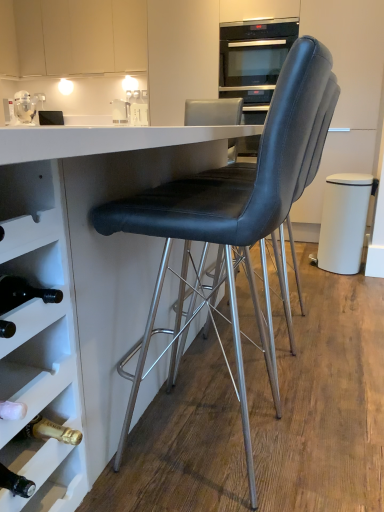
What is the approximate height of black leather chair at center, which is the second chair from back to front?

3.65 feet.

In order to face black leather chair at center, the 2th chair in the front-to-back sequence, should I rotate leftwards or rightwards?

It's best to rotate right around 10.428 degrees.

You are a GUI agent. You are given a task and a screenshot of the screen. Output one action in this format:
    pyautogui.click(x=<x>, y=<y>)
    Task: Click on the matte white cabinet at upper left
    The image size is (384, 512).
    Given the screenshot: What is the action you would take?
    pyautogui.click(x=72, y=36)

The height and width of the screenshot is (512, 384). Describe the element at coordinates (72, 36) in the screenshot. I see `matte white cabinet at upper left` at that location.

At what (x,y) coordinates should I click in order to perform the action: click on clear glass jar at upper left. Please return your answer as a coordinate pair (x, y). The image size is (384, 512). Looking at the image, I should click on (24, 106).

Describe the element at coordinates (120, 111) in the screenshot. This screenshot has height=512, width=384. I see `metallic silver kettle at upper center` at that location.

Identify the location of white glossy table at center. (78, 292).

Based on the photo, is metallic silver kettle at upper center turned away from white matte trash can at right?

That's not correct — metallic silver kettle at upper center is not looking away from white matte trash can at right.

Can you tell me how much metallic silver kettle at upper center and white matte trash can at right differ in facing direction?

The angular difference between metallic silver kettle at upper center and white matte trash can at right is 89 degrees.

Considering the points (123, 114) and (347, 244), which point is behind, point (123, 114) or point (347, 244)?

The point (123, 114) is more distant.

From the image's perspective, who appears lower, metallic silver kettle at upper center or white matte trash can at right?

white matte trash can at right appears lower in the image.

Considering the sizes of objects matte white cabinet at upper left and white matte trash can at right in the image provided, who is thinner, matte white cabinet at upper left or white matte trash can at right?

Thinner between the two is matte white cabinet at upper left.

The image size is (384, 512). Identify the location of bar stool to the right of matte white cabinet at upper left. (343, 222).

From the image's perspective, which one is positioned lower, matte white cabinet at upper left or white matte trash can at right?

From the image's view, white matte trash can at right is below.

Considering the positions of point (59, 17) and point (353, 203), is point (59, 17) closer or farther from the camera than point (353, 203)?

Clearly, point (59, 17) is more distant from the camera than point (353, 203).

Is black leather chair at center, arranged as the 1th chair when viewed from the front, oriented away from white matte trash can at right?

No.

In the scene shown: Which of these two, black leather chair at center, which is the second chair from back to front, or white matte trash can at right, is thinner?

With smaller width is white matte trash can at right.

Looking at this image, which object is further away from the camera taking this photo, black leather chair at center, which is the second chair from back to front, or white matte trash can at right?

Positioned behind is white matte trash can at right.

From a real-world perspective, between black leather chair at center, which is the second chair from back to front, and white matte trash can at right, who is vertically lower?

In real-world perspective, white matte trash can at right is lower.

From the image's perspective, is black glass oven at upper center below matte white cabinet at upper left?

Indeed, from the image's perspective, black glass oven at upper center is shown beneath matte white cabinet at upper left.

Which of these two, black glass oven at upper center or matte white cabinet at upper left, is thinner?

Thinner between the two is matte white cabinet at upper left.

Is black glass oven at upper center not within matte white cabinet at upper left?

Indeed, black glass oven at upper center is completely outside matte white cabinet at upper left.

Is the position of black glass oven at upper center more distant than that of matte white cabinet at upper left?

No.

In the scene shown: From the image's perspective, is black glass oven at upper center positioned above or below black leather chair at center, which is the second chair from back to front?

black glass oven at upper center is above black leather chair at center, which is the second chair from back to front.

From a real-world perspective, is black glass oven at upper center physically located above or below black leather chair at center, arranged as the 1th chair when viewed from the front?

Clearly, from a real-world perspective, black glass oven at upper center is above black leather chair at center, arranged as the 1th chair when viewed from the front.

Is point (235, 45) closer to camera compared to point (235, 237)?

No, (235, 45) is behind (235, 237).

Considering the sizes of objects black leather chair at center, the 2th chair in the front-to-back sequence, and white glossy table at center in the image provided, who is shorter, black leather chair at center, the 2th chair in the front-to-back sequence, or white glossy table at center?

white glossy table at center is shorter.

From a real-world perspective, between black leather chair at center, which is the first chair from back to front, and white glossy table at center, who is vertically higher?

black leather chair at center, which is the first chair from back to front, is physically above.

Looking at the image, does black leather chair at center, which is the first chair from back to front, seem bigger or smaller compared to white glossy table at center?

black leather chair at center, which is the first chair from back to front, is smaller than white glossy table at center.

Is black leather chair at center, the 2th chair in the front-to-back sequence, completely or partially outside of white glossy table at center?

No, black leather chair at center, the 2th chair in the front-to-back sequence, is inside white glossy table at center's boundary.

Image resolution: width=384 pixels, height=512 pixels. Find the location of `kitchen appliance beneath the matte white cabinet at upper left (from a real-world perspective)`. kitchen appliance beneath the matte white cabinet at upper left (from a real-world perspective) is located at coordinates (24, 106).

Which is behind, clear glass jar at upper left or matte white cabinet at upper left?

clear glass jar at upper left is further from the camera.

Can you confirm if clear glass jar at upper left is shorter than matte white cabinet at upper left?

Indeed, clear glass jar at upper left has a lesser height compared to matte white cabinet at upper left.

The image size is (384, 512). Identify the location of appliance on the left of the white matte trash can at right. (x=120, y=111).

Locate an element on the screen. cabinetry above the white matte trash can at right (from a real-world perspective) is located at coordinates (72, 36).

Based on their spatial positions, is matte white cabinet at upper left or clear glass jar at upper left further from black leather chair at center, which is the second chair from back to front?

matte white cabinet at upper left is positioned further to the anchor black leather chair at center, which is the second chair from back to front.

Based on their spatial positions, is black leather chair at center, which is the first chair from back to front, or clear glass jar at upper left closer to black glass oven at upper center?

clear glass jar at upper left is closer to black glass oven at upper center.

Estimate the real-world distances between objects in this image. Which object is further from black leather chair at center, arranged as the 1th chair when viewed from the front, black glass oven at upper center or clear glass jar at upper left?

Based on the image, clear glass jar at upper left appears to be further to black leather chair at center, arranged as the 1th chair when viewed from the front.

From the image, which object appears to be farther from black glass oven at upper center, matte white cabinet at upper left or black leather chair at center, the 2th chair in the front-to-back sequence?

black leather chair at center, the 2th chair in the front-to-back sequence, is positioned further to the anchor black glass oven at upper center.

Considering their positions, is black glass oven at upper center positioned further to black leather chair at center, which is the first chair from back to front, than black leather chair at center, arranged as the 1th chair when viewed from the front?

black glass oven at upper center is further to black leather chair at center, which is the first chair from back to front.

In the scene shown: Estimate the real-world distances between objects in this image. Which object is further from white matte trash can at right, metallic silver kettle at upper center or black leather chair at center, which is the second chair from back to front?

metallic silver kettle at upper center is positioned further to the anchor white matte trash can at right.

Which object lies further to the anchor point black glass oven at upper center, black leather chair at center, which is the first chair from back to front, or metallic silver kettle at upper center?

black leather chair at center, which is the first chair from back to front.

Looking at the image, which one is located closer to black glass oven at upper center, matte white cabinet at upper left or metallic silver kettle at upper center?

A: matte white cabinet at upper left is positioned closer to the anchor black glass oven at upper center.

The height and width of the screenshot is (512, 384). What are the coordinates of `bar stool between black leather chair at center, which is the second chair from back to front, and metallic silver kettle at upper center from front to back` in the screenshot? It's located at (343, 222).

This screenshot has width=384, height=512. In order to click on appliance situated between clear glass jar at upper left and white matte trash can at right from left to right in this screenshot , I will do `click(120, 111)`.

Locate an element on the screen. home appliance located between white glossy table at center and metallic silver kettle at upper center in the depth direction is located at coordinates (254, 57).

You are a GUI agent. You are given a task and a screenshot of the screen. Output one action in this format:
    pyautogui.click(x=<x>, y=<y>)
    Task: Click on the home appliance between black leather chair at center, which is the first chair from back to front, and matte white cabinet at upper left from front to back
    
    Given the screenshot: What is the action you would take?
    pyautogui.click(x=254, y=57)